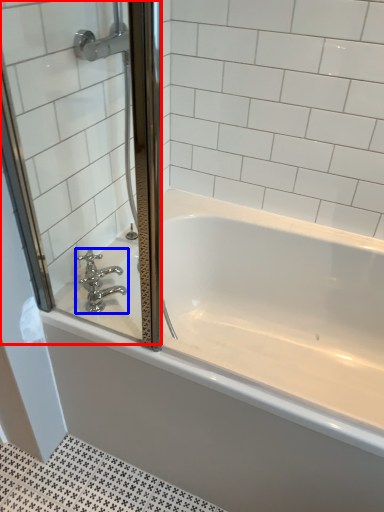
Question: Among these objects, which one is nearest to the camera, screen door (highlighted by a red box) or tap (highlighted by a blue box)?

Choices:
 (A) screen door
 (B) tap

Answer: (A)